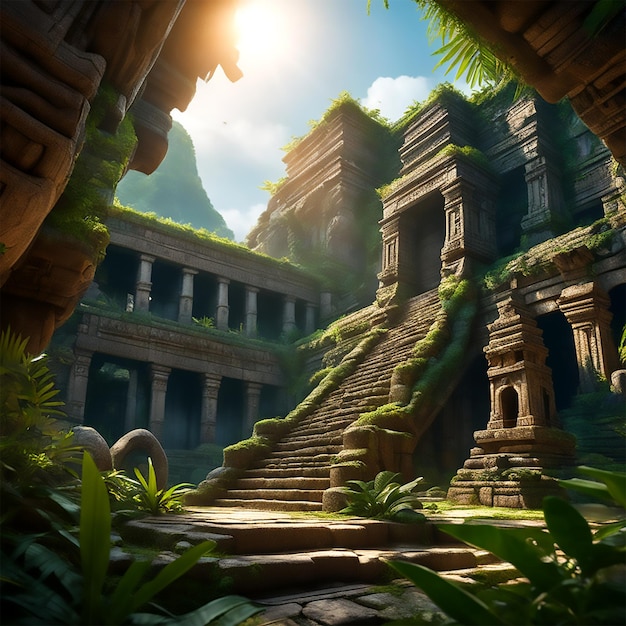
Identify the location of green plants. (376, 491), (156, 493), (34, 386).